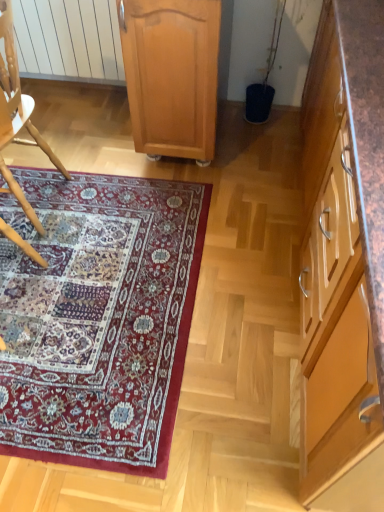
Question: From the image's perspective, would you say carpet with intricate patterns at lower left is positioned over wooden chair at left?

Choices:
 (A) no
 (B) yes

Answer: (A)

Question: Is carpet with intricate patterns at lower left taller than wooden chair at left?

Choices:
 (A) yes
 (B) no

Answer: (B)

Question: Does carpet with intricate patterns at lower left have a greater width compared to wooden chair at left?

Choices:
 (A) no
 (B) yes

Answer: (B)

Question: Is the depth of carpet with intricate patterns at lower left greater than that of wooden chair at left?

Choices:
 (A) no
 (B) yes

Answer: (B)

Question: Is carpet with intricate patterns at lower left completely or partially outside of wooden chair at left?

Choices:
 (A) yes
 (B) no

Answer: (A)

Question: Considering the positions of wooden chair at left and brown wood cabinet at right, the 2th cabinetry positioned from the left, in the image, is wooden chair at left bigger or smaller than brown wood cabinet at right, the 2th cabinetry positioned from the left,?

Choices:
 (A) small
 (B) big

Answer: (A)

Question: Is wooden chair at left wider or thinner than brown wood cabinet at right, the 2th cabinetry positioned from the left?

Choices:
 (A) wide
 (B) thin

Answer: (B)

Question: Considering the positions of wooden chair at left and brown wood cabinet at right, arranged as the first cabinetry when viewed from the right, in the image, is wooden chair at left taller or shorter than brown wood cabinet at right, arranged as the first cabinetry when viewed from the right,?

Choices:
 (A) tall
 (B) short

Answer: (B)

Question: From the image's perspective, is wooden chair at left located above or below brown wood cabinet at right, arranged as the first cabinetry when viewed from the right?

Choices:
 (A) above
 (B) below

Answer: (A)

Question: From a real-world perspective, is brown wood cabinet at right, the 2th cabinetry positioned from the left, positioned above or below carpet with intricate patterns at lower left?

Choices:
 (A) above
 (B) below

Answer: (A)

Question: Is brown wood cabinet at right, arranged as the first cabinetry when viewed from the right, spatially inside carpet with intricate patterns at lower left, or outside of it?

Choices:
 (A) inside
 (B) outside

Answer: (B)

Question: Is point (322, 222) positioned closer to the camera than point (19, 378)?

Choices:
 (A) farther
 (B) closer

Answer: (B)

Question: Is brown wood cabinet at right, arranged as the first cabinetry when viewed from the right, to the left or to the right of carpet with intricate patterns at lower left in the image?

Choices:
 (A) right
 (B) left

Answer: (A)

Question: In terms of size, does carpet with intricate patterns at lower left appear bigger or smaller than light brown wood cabinet at center, arranged as the 2th cabinetry when viewed from the right?

Choices:
 (A) small
 (B) big

Answer: (A)

Question: Considering the positions of carpet with intricate patterns at lower left and light brown wood cabinet at center, which is the first cabinetry from left to right, in the image, is carpet with intricate patterns at lower left wider or thinner than light brown wood cabinet at center, which is the first cabinetry from left to right,?

Choices:
 (A) wide
 (B) thin

Answer: (A)